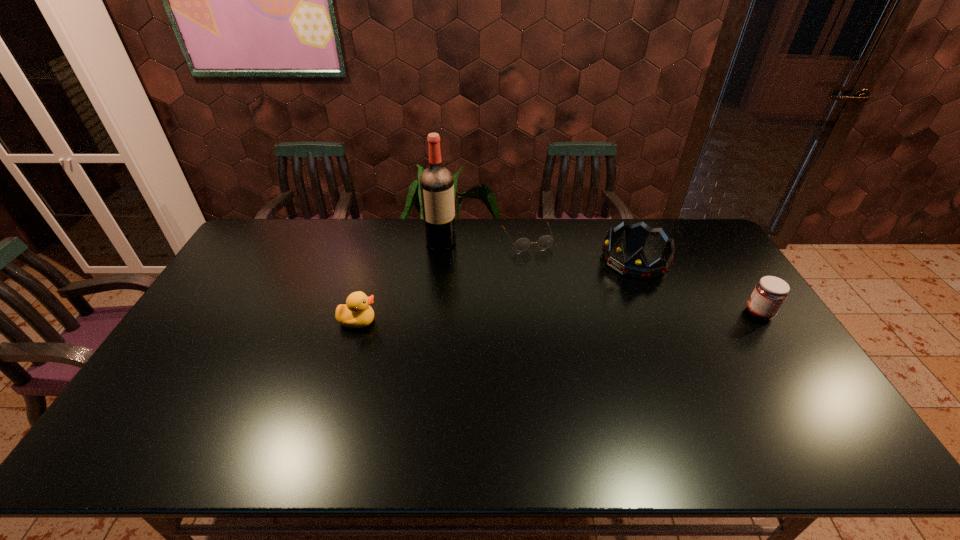
Identify the location of free space between the leftmost object and the second object from left to right. Image resolution: width=960 pixels, height=540 pixels. (399, 282).

Find the location of `free space between the fourth object from left to right and the spectacles`. free space between the fourth object from left to right and the spectacles is located at coordinates [x=581, y=249].

Where is `vacant region between the rightmost object and the leftmost object`? vacant region between the rightmost object and the leftmost object is located at coordinates (559, 317).

Find the location of `free space between the jam and the liquor`. free space between the jam and the liquor is located at coordinates (600, 278).

The image size is (960, 540). In order to click on empty location between the tallest object and the duckling in this screenshot , I will do `click(399, 282)`.

Where is `vacant space that's between the rightmost object and the fourth object from right to left`? vacant space that's between the rightmost object and the fourth object from right to left is located at coordinates (600, 278).

Where is `vacant space that is in between the fourth object from left to right and the tallest object`? The width and height of the screenshot is (960, 540). vacant space that is in between the fourth object from left to right and the tallest object is located at coordinates (538, 251).

Locate an element on the screen. vacant point located between the leftmost object and the rightmost object is located at coordinates click(559, 317).

Choose which object is the nearest neighbor to the spectacles. Please provide its 2D coordinates. Your answer should be formatted as a tuple, i.e. [(x, y)], where the tuple contains the x and y coordinates of a point satisfying the conditions above.

[(637, 266)]

Where is `object that ranks as the fourth closest to the shortest object`? The image size is (960, 540). object that ranks as the fourth closest to the shortest object is located at coordinates (770, 292).